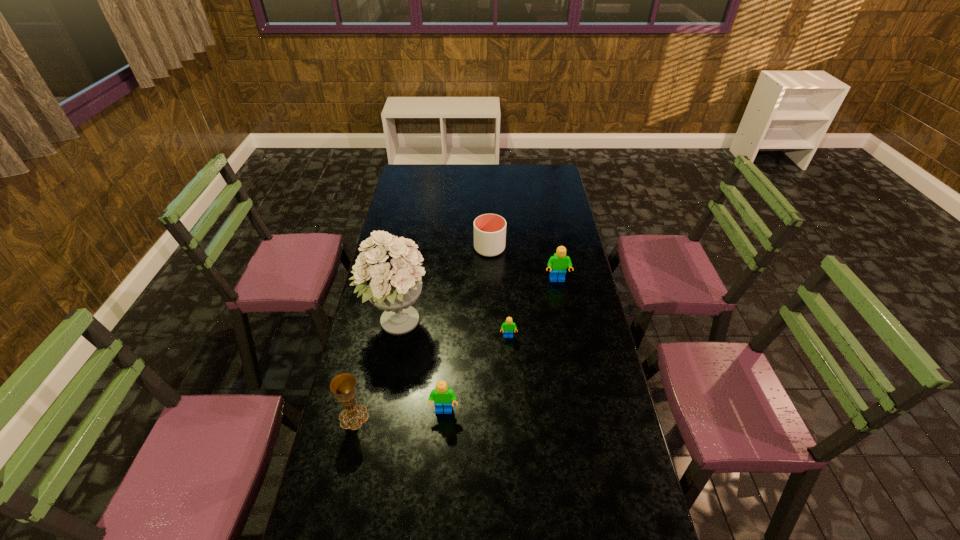
I want to click on vacant space located 0.360m on the face of the shortest object, so click(514, 430).

Locate an element on the screen. The width and height of the screenshot is (960, 540). vacant space located 0.160m on the face of the farthest Lego is located at coordinates (564, 313).

Locate an element on the screen. The height and width of the screenshot is (540, 960). vacant space located 0.400m on the back of the cup is located at coordinates (488, 193).

The width and height of the screenshot is (960, 540). I want to click on free space located 0.290m on the back of the tallest object, so click(410, 252).

The width and height of the screenshot is (960, 540). Identify the location of free space located on the front of the chalice. (345, 458).

Where is `bouquet that is at the left edge`? This screenshot has height=540, width=960. bouquet that is at the left edge is located at coordinates (390, 275).

What are the coordinates of `chalice located in the left edge section of the desktop` in the screenshot? It's located at (343, 385).

Locate an element on the screen. This screenshot has width=960, height=540. object present at the right edge is located at coordinates (558, 263).

This screenshot has width=960, height=540. What are the coordinates of `vacant space at the far edge of the desktop` in the screenshot? It's located at (501, 173).

This screenshot has height=540, width=960. In the image, there is a desktop. What are the coordinates of `free space at the left edge` in the screenshot? It's located at (393, 226).